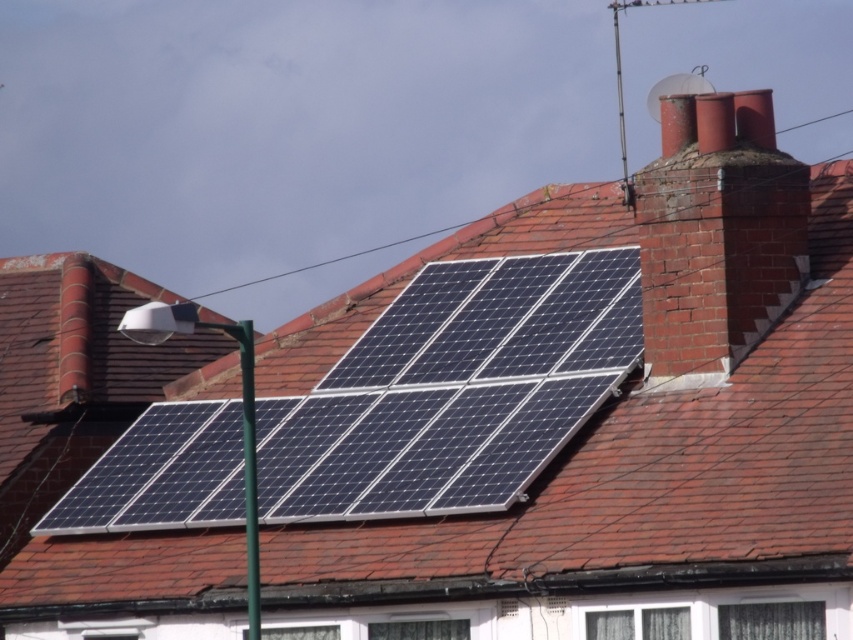
You are standing on the roof and need to install a new satellite dish. The existing satellite dish is mounted above the brick chimney to the right of the solar panels. Where should you place the new satellite dish to avoid shading the dark blue solar panels at center?

Place the new satellite dish on the opposite side of the dark blue solar panels at center, away from the brick chimney to the right, to prevent shading.

You are a technician inspecting a roof. You need to access the satellite dish above the red brick chimney at upper right. The dark blue solar panels at center are in the way. Can you safely walk over the solar panels to reach the chimney?

The dark blue solar panels at center are located below the red brick chimney at upper right, so you can safely walk over the solar panels to reach the chimney since they are positioned underneath it.